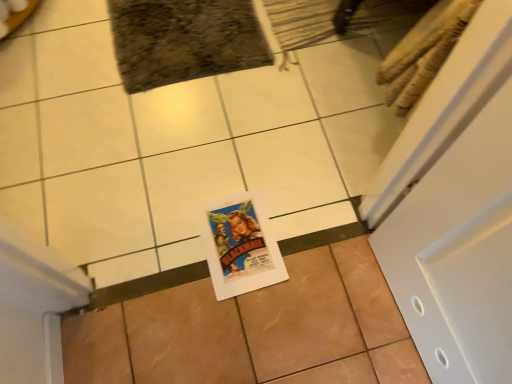
How much space does brown glossy tile at center, which ranks as the 1th ceramic tile in bottom-to-top order, occupy horizontally?

brown glossy tile at center, which ranks as the 1th ceramic tile in bottom-to-top order, is 18.14 inches wide.

Image resolution: width=512 pixels, height=384 pixels. I want to click on brown glossy tile at center, which ranks as the 1th ceramic tile in bottom-to-top order, so click(x=253, y=330).

The width and height of the screenshot is (512, 384). What do you see at coordinates (253, 330) in the screenshot? I see `brown glossy tile at center, which ranks as the 2th ceramic tile in top-to-bottom order` at bounding box center [253, 330].

The image size is (512, 384). In order to click on brown glossy tile at center, placed as the first ceramic tile when sorted from top to bottom in this screenshot , I will do pos(178,143).

Describe the element at coordinates (178, 143) in the screenshot. I see `brown glossy tile at center, placed as the first ceramic tile when sorted from top to bottom` at that location.

Find the location of `brown glossy tile at center, which ranks as the 1th ceramic tile in bottom-to-top order`. brown glossy tile at center, which ranks as the 1th ceramic tile in bottom-to-top order is located at coordinates (253, 330).

Is brown glossy tile at center, placed as the first ceramic tile when sorted from top to bottom, to the left of brown glossy tile at center, which ranks as the 2th ceramic tile in top-to-bottom order, from the viewer's perspective?

Yes.

Considering their positions, is brown glossy tile at center, which ranks as the second ceramic tile in bottom-to-top order, located in front of or behind brown glossy tile at center, which ranks as the 1th ceramic tile in bottom-to-top order?

In the image, brown glossy tile at center, which ranks as the second ceramic tile in bottom-to-top order, appears behind brown glossy tile at center, which ranks as the 1th ceramic tile in bottom-to-top order.

Is point (50, 3) positioned behind point (282, 305)?

Yes, it is behind point (282, 305).

From the image's perspective, which is below, brown glossy tile at center, which ranks as the second ceramic tile in bottom-to-top order, or brown glossy tile at center, which ranks as the 1th ceramic tile in bottom-to-top order?

brown glossy tile at center, which ranks as the 1th ceramic tile in bottom-to-top order, appears lower in the image.

From a real-world perspective, who is located higher, brown glossy tile at center, which ranks as the second ceramic tile in bottom-to-top order, or brown glossy tile at center, which ranks as the 2th ceramic tile in top-to-bottom order?

In real-world perspective, brown glossy tile at center, which ranks as the second ceramic tile in bottom-to-top order, is above.

Which of these two, brown glossy tile at center, which ranks as the second ceramic tile in bottom-to-top order, or brown glossy tile at center, which ranks as the 1th ceramic tile in bottom-to-top order, is thinner?

Thinner between the two is brown glossy tile at center, which ranks as the 1th ceramic tile in bottom-to-top order.

Can you confirm if brown glossy tile at center, which ranks as the second ceramic tile in bottom-to-top order, is taller than brown glossy tile at center, which ranks as the 2th ceramic tile in top-to-bottom order?

Yes, brown glossy tile at center, which ranks as the second ceramic tile in bottom-to-top order, is taller than brown glossy tile at center, which ranks as the 2th ceramic tile in top-to-bottom order.

In the scene shown: Considering the relative sizes of brown glossy tile at center, placed as the first ceramic tile when sorted from top to bottom, and brown glossy tile at center, which ranks as the 2th ceramic tile in top-to-bottom order, in the image provided, is brown glossy tile at center, placed as the first ceramic tile when sorted from top to bottom, bigger than brown glossy tile at center, which ranks as the 2th ceramic tile in top-to-bottom order,?

Indeed, brown glossy tile at center, placed as the first ceramic tile when sorted from top to bottom, has a larger size compared to brown glossy tile at center, which ranks as the 2th ceramic tile in top-to-bottom order.

From the picture: Is brown glossy tile at center, placed as the first ceramic tile when sorted from top to bottom, located outside brown glossy tile at center, which ranks as the 1th ceramic tile in bottom-to-top order?

brown glossy tile at center, placed as the first ceramic tile when sorted from top to bottom, lies outside brown glossy tile at center, which ranks as the 1th ceramic tile in bottom-to-top order,'s area.

Is brown glossy tile at center, which ranks as the second ceramic tile in bottom-to-top order, in contact with brown glossy tile at center, which ranks as the 1th ceramic tile in bottom-to-top order?

No, brown glossy tile at center, which ranks as the second ceramic tile in bottom-to-top order, is not with brown glossy tile at center, which ranks as the 1th ceramic tile in bottom-to-top order.

Is brown glossy tile at center, which ranks as the 2th ceramic tile in top-to-bottom order, at the back of brown glossy tile at center, placed as the first ceramic tile when sorted from top to bottom?

That's not correct — brown glossy tile at center, placed as the first ceramic tile when sorted from top to bottom, is not looking away from brown glossy tile at center, which ranks as the 2th ceramic tile in top-to-bottom order.

Measure the distance from brown glossy tile at center, placed as the first ceramic tile when sorted from top to bottom, to brown glossy tile at center, which ranks as the 2th ceramic tile in top-to-bottom order.

brown glossy tile at center, placed as the first ceramic tile when sorted from top to bottom, and brown glossy tile at center, which ranks as the 2th ceramic tile in top-to-bottom order, are 16.16 inches apart.

Where is `ceramic tile behind the brown glossy tile at center, which ranks as the 2th ceramic tile in top-to-bottom order`? The width and height of the screenshot is (512, 384). ceramic tile behind the brown glossy tile at center, which ranks as the 2th ceramic tile in top-to-bottom order is located at coordinates (178, 143).

Can you confirm if brown glossy tile at center, which ranks as the 2th ceramic tile in top-to-bottom order, is positioned to the right of brown glossy tile at center, placed as the first ceramic tile when sorted from top to bottom?

Yes, brown glossy tile at center, which ranks as the 2th ceramic tile in top-to-bottom order, is to the right of brown glossy tile at center, placed as the first ceramic tile when sorted from top to bottom.

Considering the positions of objects brown glossy tile at center, which ranks as the 2th ceramic tile in top-to-bottom order, and brown glossy tile at center, placed as the first ceramic tile when sorted from top to bottom, in the image provided, who is behind, brown glossy tile at center, which ranks as the 2th ceramic tile in top-to-bottom order, or brown glossy tile at center, placed as the first ceramic tile when sorted from top to bottom,?

brown glossy tile at center, placed as the first ceramic tile when sorted from top to bottom, is more distant.

Considering the positions of point (161, 291) and point (329, 136), is point (161, 291) closer or farther from the camera than point (329, 136)?

Point (161, 291) is closer to the camera than point (329, 136).

From the image's perspective, is brown glossy tile at center, which ranks as the 1th ceramic tile in bottom-to-top order, below brown glossy tile at center, placed as the first ceramic tile when sorted from top to bottom?

Yes, from the image's perspective, brown glossy tile at center, which ranks as the 1th ceramic tile in bottom-to-top order, is below brown glossy tile at center, placed as the first ceramic tile when sorted from top to bottom.

From a real-world perspective, does brown glossy tile at center, which ranks as the 1th ceramic tile in bottom-to-top order, sit lower than brown glossy tile at center, which ranks as the second ceramic tile in bottom-to-top order?

Yes, from a real-world perspective, brown glossy tile at center, which ranks as the 1th ceramic tile in bottom-to-top order, is below brown glossy tile at center, which ranks as the second ceramic tile in bottom-to-top order.

Is brown glossy tile at center, which ranks as the 1th ceramic tile in bottom-to-top order, wider than brown glossy tile at center, which ranks as the second ceramic tile in bottom-to-top order?

No.

Is brown glossy tile at center, which ranks as the 1th ceramic tile in bottom-to-top order, taller than brown glossy tile at center, placed as the first ceramic tile when sorted from top to bottom?

No, brown glossy tile at center, which ranks as the 1th ceramic tile in bottom-to-top order, is not taller than brown glossy tile at center, placed as the first ceramic tile when sorted from top to bottom.

Between brown glossy tile at center, which ranks as the 1th ceramic tile in bottom-to-top order, and brown glossy tile at center, placed as the first ceramic tile when sorted from top to bottom, which one has larger size?

brown glossy tile at center, placed as the first ceramic tile when sorted from top to bottom.

Does brown glossy tile at center, which ranks as the 2th ceramic tile in top-to-bottom order, contain brown glossy tile at center, which ranks as the second ceramic tile in bottom-to-top order?

No, brown glossy tile at center, which ranks as the 2th ceramic tile in top-to-bottom order, does not contain brown glossy tile at center, which ranks as the second ceramic tile in bottom-to-top order.

Is brown glossy tile at center, which ranks as the 1th ceramic tile in bottom-to-top order, placed right next to brown glossy tile at center, placed as the first ceramic tile when sorted from top to bottom?

brown glossy tile at center, which ranks as the 1th ceramic tile in bottom-to-top order, is not next to brown glossy tile at center, placed as the first ceramic tile when sorted from top to bottom, and they're not touching.

Is brown glossy tile at center, which ranks as the 2th ceramic tile in top-to-bottom order, oriented towards brown glossy tile at center, placed as the first ceramic tile when sorted from top to bottom?

Yes, brown glossy tile at center, which ranks as the 2th ceramic tile in top-to-bottom order, is aimed at brown glossy tile at center, placed as the first ceramic tile when sorted from top to bottom.

Can you tell me how much brown glossy tile at center, which ranks as the 2th ceramic tile in top-to-bottom order, and brown glossy tile at center, which ranks as the second ceramic tile in bottom-to-top order, differ in facing direction?

180 degrees.

This screenshot has height=384, width=512. I want to click on ceramic tile above the brown glossy tile at center, which ranks as the 2th ceramic tile in top-to-bottom order (from the image's perspective), so click(x=178, y=143).

Identify the location of ceramic tile above the brown glossy tile at center, which ranks as the 1th ceramic tile in bottom-to-top order (from a real-world perspective). This screenshot has height=384, width=512. (178, 143).

At what (x,y) coordinates should I click in order to perform the action: click on ceramic tile located underneath the brown glossy tile at center, placed as the first ceramic tile when sorted from top to bottom (from a real-world perspective). Please return your answer as a coordinate pair (x, y). Looking at the image, I should click on (253, 330).